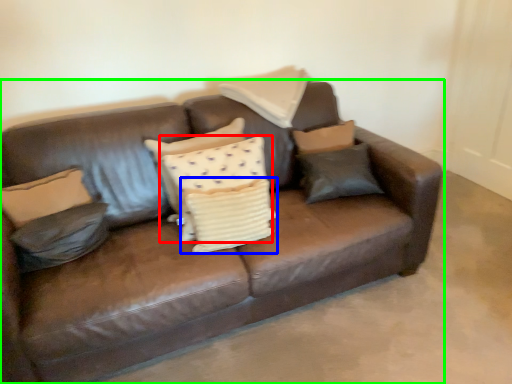
Question: Which object is the closest to the pillow (highlighted by a red box)? Choose among these: pillow (highlighted by a blue box) or studio couch (highlighted by a green box).

Choices:
 (A) pillow
 (B) studio couch

Answer: (A)